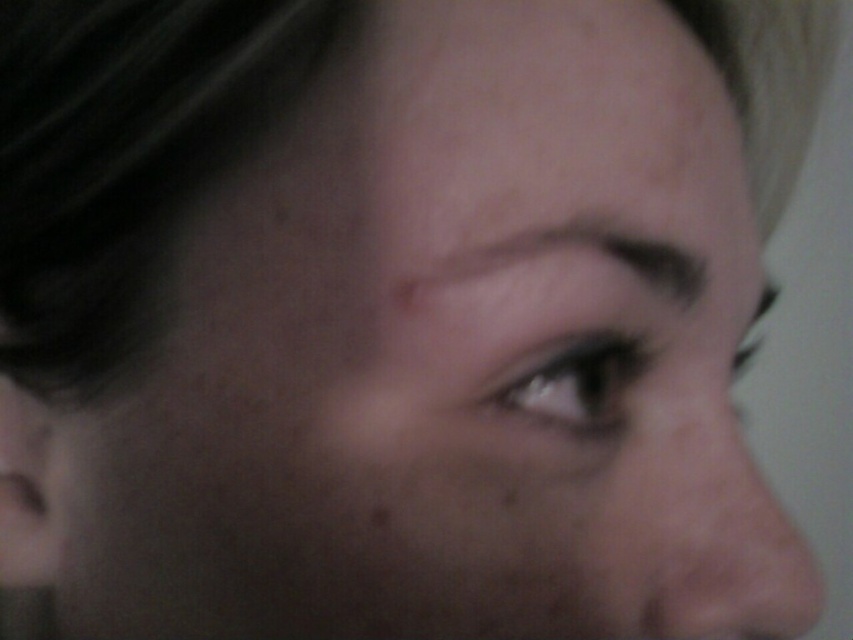
Is point (697, 264) closer to camera compared to point (625, 385)?

No.

Who is taller, dark brown eyebrow at upper center or smokey gray eye at center?

smokey gray eye at center

What are the coordinates of `dark brown eyebrow at upper center` in the screenshot? It's located at (566, 250).

Does pink smooth skin at lower right appear on the left side of dark brown eyebrow at upper center?

In fact, pink smooth skin at lower right is to the right of dark brown eyebrow at upper center.

At what (x,y) coordinates should I click in order to perform the action: click on pink smooth skin at lower right. Please return your answer as a coordinate pair (x, y). The height and width of the screenshot is (640, 853). Looking at the image, I should click on (730, 548).

Where is `pink smooth skin at lower right`? The image size is (853, 640). pink smooth skin at lower right is located at coordinates (730, 548).

Is pink smooth skin at lower right positioned before smokey gray eye at center?

No, pink smooth skin at lower right is further to the viewer.

Which is behind, point (682, 580) or point (643, 348)?

Positioned behind is point (643, 348).

The width and height of the screenshot is (853, 640). What are the coordinates of `pink smooth skin at lower right` in the screenshot? It's located at (730, 548).